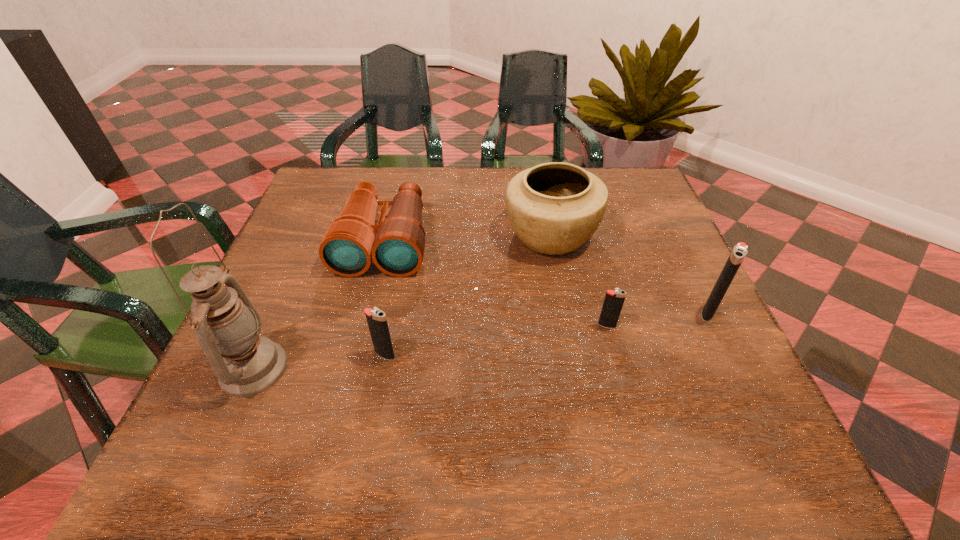
Please point a space for a new igniter to maintain equal intervals. Please provide its 2D coordinates. Your answer should be formatted as a tuple, i.e. [(x, y)], where the tuple contains the x and y coordinates of a point satisfying the conditions above.

[(499, 340)]